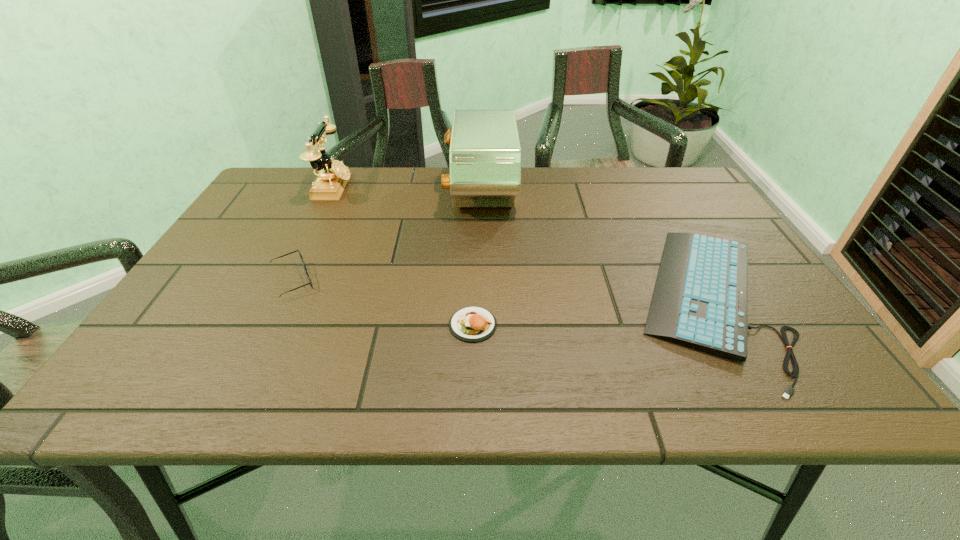
I want to click on free location that satisfies the following two spatial constraints: 1. with the lenses facing outward on the spectacles; 2. on the right side of the patty (food), so click(271, 325).

Image resolution: width=960 pixels, height=540 pixels. In order to click on free space that satisfies the following two spatial constraints: 1. on the door side of the toaster oven; 2. on the back side of the computer keyboard in this screenshot , I will do `click(481, 300)`.

Identify the location of vacant space that satisfies the following two spatial constraints: 1. on the dial of the telephone; 2. on the back side of the shortest object. The height and width of the screenshot is (540, 960). (278, 300).

Where is `vacant point that satisfies the following two spatial constraints: 1. on the door side of the toaster oven; 2. on the front side of the patty (food)`? The image size is (960, 540). vacant point that satisfies the following two spatial constraints: 1. on the door side of the toaster oven; 2. on the front side of the patty (food) is located at coordinates (481, 325).